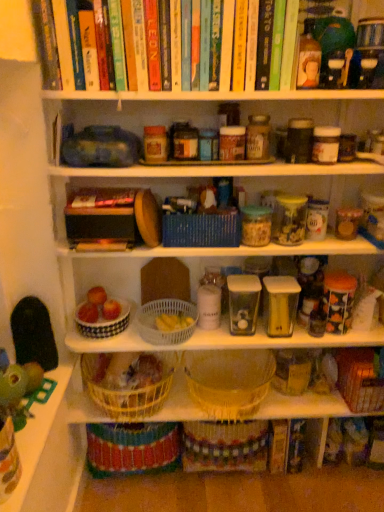
In order to face translucent plastic toy at lower left, the 1th toy from the front, should I rotate leftwards or rightwards?

To face it directly, rotate left by 23.573 degrees.

How much space does blue woven basket at center, arranged as the third basket when viewed from the right, occupy vertically?

blue woven basket at center, arranged as the third basket when viewed from the right, is 4.87 inches in height.

This screenshot has width=384, height=512. In order to click on transparent plastic container at center, the second glass jar viewed from the right in this screenshot , I will do tap(243, 303).

Locate an element on the screen. white plastic basket at center, acting as the fourth basket starting from the right is located at coordinates (165, 313).

I want to click on white ceramic bowl at center, the sixth basket when ordered from right to left, so click(x=105, y=323).

Between transparent plastic container at center-right, which ranks as the 1th glass jar in right-to-left order, and white plastic basket at center, acting as the fourth basket starting from the right, which one is positioned behind?

white plastic basket at center, acting as the fourth basket starting from the right, is further away from the camera.

Considering the sizes of objects transparent plastic container at center-right, which ranks as the second glass jar in left-to-right order, and white plastic basket at center, the 3th basket in the left-to-right sequence, in the image provided, who is taller, transparent plastic container at center-right, which ranks as the second glass jar in left-to-right order, or white plastic basket at center, the 3th basket in the left-to-right sequence,?

transparent plastic container at center-right, which ranks as the second glass jar in left-to-right order.

Considering the sizes of objects transparent plastic container at center-right, which ranks as the second glass jar in left-to-right order, and white plastic basket at center, the 3th basket in the left-to-right sequence, in the image provided, who is bigger, transparent plastic container at center-right, which ranks as the second glass jar in left-to-right order, or white plastic basket at center, the 3th basket in the left-to-right sequence,?

white plastic basket at center, the 3th basket in the left-to-right sequence, is bigger.

Is transparent plastic container at center-right, which ranks as the second glass jar in left-to-right order, oriented towards white plastic basket at center, acting as the fourth basket starting from the right?

No, transparent plastic container at center-right, which ranks as the second glass jar in left-to-right order, does not turn towards white plastic basket at center, acting as the fourth basket starting from the right.

Is point (118, 334) positioned behind point (285, 290)?

Yes.

Is white ceramic bowl at center, which is the 1th basket from left to right, far from transparent plastic container at center-right, which ranks as the 1th glass jar in right-to-left order?

Actually, white ceramic bowl at center, which is the 1th basket from left to right, and transparent plastic container at center-right, which ranks as the 1th glass jar in right-to-left order, are a little close together.

Would you say transparent plastic container at center-right, which ranks as the second glass jar in left-to-right order, is part of white ceramic bowl at center, which is the 1th basket from left to right,'s contents?

No.

Can we say blue woven basket at center, arranged as the third basket when viewed from the right, lies outside translucent plastic toy at lower left, the 1th toy from the front?

blue woven basket at center, arranged as the third basket when viewed from the right, lies outside translucent plastic toy at lower left, the 1th toy from the front,'s area.

How different are the orientations of blue woven basket at center, positioned as the fourth basket in left-to-right order, and translucent plastic toy at lower left, the 1th toy from the front, in degrees?

The angular difference between blue woven basket at center, positioned as the fourth basket in left-to-right order, and translucent plastic toy at lower left, the 1th toy from the front, is 93.3 degrees.

Relative to translucent plastic toy at lower left, which is the second toy in back-to-front order, is blue woven basket at center, positioned as the fourth basket in left-to-right order, in front or behind?

blue woven basket at center, positioned as the fourth basket in left-to-right order, is behind translucent plastic toy at lower left, which is the second toy in back-to-front order.

From the image's perspective, does blue woven basket at center, positioned as the fourth basket in left-to-right order, appear lower than translucent plastic toy at lower left, which is the second toy in back-to-front order?

No, from the image's perspective, blue woven basket at center, positioned as the fourth basket in left-to-right order, is not below translucent plastic toy at lower left, which is the second toy in back-to-front order.

Could you measure the distance between transparent plastic container at center, the second glass jar viewed from the right, and woven straw basket at center, marked as the 5th basket in a left-to-right arrangement?

They are 12.95 inches apart.

Is transparent plastic container at center, the second glass jar viewed from the right, facing away from woven straw basket at center, which is the second basket from right to left?

transparent plastic container at center, the second glass jar viewed from the right, is not turned away from woven straw basket at center, which is the second basket from right to left.

Based on the photo, from the image's perspective, is transparent plastic container at center, marked as the first glass jar in a left-to-right arrangement, above woven straw basket at center, marked as the 5th basket in a left-to-right arrangement?

Yes, from the image's perspective, transparent plastic container at center, marked as the first glass jar in a left-to-right arrangement, is on top of woven straw basket at center, marked as the 5th basket in a left-to-right arrangement.

Which of these two, transparent plastic container at center, marked as the first glass jar in a left-to-right arrangement, or woven straw basket at center, marked as the 5th basket in a left-to-right arrangement, is thinner?

With smaller width is transparent plastic container at center, marked as the first glass jar in a left-to-right arrangement.

The height and width of the screenshot is (512, 384). I want to click on basket that is the 1st object directly below the white plastic basket at center, acting as the fourth basket starting from the right (from a real-world perspective), so click(x=229, y=381).

Would you say white plastic basket at center, acting as the fourth basket starting from the right, is to the left or to the right of woven straw basket at center, marked as the 5th basket in a left-to-right arrangement, in the picture?

Based on their positions, white plastic basket at center, acting as the fourth basket starting from the right, is located to the left of woven straw basket at center, marked as the 5th basket in a left-to-right arrangement.

Can you tell me how much white plastic basket at center, the 3th basket in the left-to-right sequence, and woven straw basket at center, marked as the 5th basket in a left-to-right arrangement, differ in facing direction?

white plastic basket at center, the 3th basket in the left-to-right sequence, and woven straw basket at center, marked as the 5th basket in a left-to-right arrangement, are facing 0.00134 degrees away from each other.

Is woven straw basket at center, marked as the 5th basket in a left-to-right arrangement, at the back of white plastic basket at center, the 3th basket in the left-to-right sequence?

white plastic basket at center, the 3th basket in the left-to-right sequence, is not turned away from woven straw basket at center, marked as the 5th basket in a left-to-right arrangement.

Which object is closer to the camera, transparent plastic container at center-right, which ranks as the second glass jar in left-to-right order, or blue woven basket at center, positioned as the fourth basket in left-to-right order?

blue woven basket at center, positioned as the fourth basket in left-to-right order, is closer to the camera.

From the picture: Which point is more distant from viewer, (x=273, y=326) or (x=210, y=239)?

The point (x=273, y=326) is more distant.

Is transparent plastic container at center-right, which ranks as the 1th glass jar in right-to-left order, to the left of blue woven basket at center, positioned as the fourth basket in left-to-right order, from the viewer's perspective?

In fact, transparent plastic container at center-right, which ranks as the 1th glass jar in right-to-left order, is to the right of blue woven basket at center, positioned as the fourth basket in left-to-right order.

Between transparent plastic container at center-right, which ranks as the 1th glass jar in right-to-left order, and blue woven basket at center, positioned as the fourth basket in left-to-right order, which one has smaller width?

With smaller width is transparent plastic container at center-right, which ranks as the 1th glass jar in right-to-left order.

From a real-world perspective, is transparent plastic container at center, the second glass jar viewed from the right, positioned above or below translucent plastic toy at lower left, the 1th toy from the front?

transparent plastic container at center, the second glass jar viewed from the right, is situated higher than translucent plastic toy at lower left, the 1th toy from the front, in the real world.

Would you say transparent plastic container at center, the second glass jar viewed from the right, is outside translucent plastic toy at lower left, which is the second toy in back-to-front order?

Yes, transparent plastic container at center, the second glass jar viewed from the right, is located beyond the bounds of translucent plastic toy at lower left, which is the second toy in back-to-front order.

Does point (233, 315) come farther from viewer compared to point (26, 381)?

Yes, point (233, 315) is farther from viewer.

How many degrees apart are the facing directions of transparent plastic container at center, marked as the first glass jar in a left-to-right arrangement, and translucent plastic toy at lower left, the 1th toy from the front?

They differ by 92.2 degrees in their facing directions.

From a real-world perspective, count 2nd baskets downward from the transparent plastic container at center-right, which ranks as the second glass jar in left-to-right order, and point to it. Please provide its 2D coordinates.

[(165, 313)]

Starting from the transparent plastic container at center-right, which ranks as the 1th glass jar in right-to-left order, which basket is the 3rd one behind? Please provide its 2D coordinates.

[(105, 323)]

Looking at the image, which one is located further to transparent plastic container at center, the second glass jar viewed from the right, translucent plastic toy at lower left, the 1th toy from the front, or black rubber toy at left, which is the 1th toy in back-to-front order?

translucent plastic toy at lower left, the 1th toy from the front, is further to transparent plastic container at center, the second glass jar viewed from the right.

When comparing their distances from woven straw basket at center, marked as the 5th basket in a left-to-right arrangement, does transparent plastic container at center, the second glass jar viewed from the right, or white ceramic bowl at center, which is the 1th basket from left to right, seem closer?

transparent plastic container at center, the second glass jar viewed from the right, is positioned closer to the anchor woven straw basket at center, marked as the 5th basket in a left-to-right arrangement.

From the image, which object appears to be farther from transparent plastic container at center-right, which ranks as the 1th glass jar in right-to-left order, blue woven basket at center, arranged as the third basket when viewed from the right, or woven straw basket at center, marked as the 5th basket in a left-to-right arrangement?

woven straw basket at center, marked as the 5th basket in a left-to-right arrangement, is positioned further to the anchor transparent plastic container at center-right, which ranks as the 1th glass jar in right-to-left order.

Based on their spatial positions, is woven brown basket at lower right, which ranks as the first basket in right-to-left order, or translucent plastic toy at lower left, the 1th toy from the front, further from hardcover book at center?

woven brown basket at lower right, which ranks as the first basket in right-to-left order, is further to hardcover book at center.

Considering their positions, is hardcover book at center positioned further to translucent plastic toy at lower left, which is the second toy in back-to-front order, than black rubber toy at left, positioned as the second toy in front-to-back order?

The object further to translucent plastic toy at lower left, which is the second toy in back-to-front order, is hardcover book at center.

Looking at this image, from the image, which object appears to be nearer to blue woven basket at center, arranged as the third basket when viewed from the right, white ceramic bowl at center, the sixth basket when ordered from right to left, or black rubber toy at left, positioned as the second toy in front-to-back order?

white ceramic bowl at center, the sixth basket when ordered from right to left, lies closer to blue woven basket at center, arranged as the third basket when viewed from the right, than the other object.

Based on their spatial positions, is white ceramic bowl at center, which is the 1th basket from left to right, or black rubber toy at left, positioned as the second toy in front-to-back order, closer to translucent plastic toy at lower left, which is the second toy in back-to-front order?

The object closer to translucent plastic toy at lower left, which is the second toy in back-to-front order, is black rubber toy at left, positioned as the second toy in front-to-back order.

Which object lies further to the anchor point translucent plastic toy at lower left, which is the second toy in back-to-front order, transparent plastic container at center-right, which ranks as the second glass jar in left-to-right order, or woven brown basket at lower right, marked as the sixth basket in a left-to-right arrangement?

woven brown basket at lower right, marked as the sixth basket in a left-to-right arrangement, is further to translucent plastic toy at lower left, which is the second toy in back-to-front order.

The image size is (384, 512). I want to click on book between black rubber toy at left, which is the 1th toy in back-to-front order, and transparent plastic container at center, marked as the first glass jar in a left-to-right arrangement, in the horizontal direction, so click(x=103, y=198).

Where is `glass jar located between translucent plastic toy at lower left, the 1th toy from the front, and transparent plastic container at center-right, which ranks as the 1th glass jar in right-to-left order, in the left-right direction`? The image size is (384, 512). glass jar located between translucent plastic toy at lower left, the 1th toy from the front, and transparent plastic container at center-right, which ranks as the 1th glass jar in right-to-left order, in the left-right direction is located at coordinates (243, 303).

You are a GUI agent. You are given a task and a screenshot of the screen. Output one action in this format:
    pyautogui.click(x=<x>, y=<y>)
    Task: Click on the book situated between translucent plastic toy at lower left, which is the second toy in back-to-front order, and woven brown basket at lower right, marked as the sixth basket in a left-to-right arrangement, from left to right
    Image resolution: width=384 pixels, height=512 pixels.
    Given the screenshot: What is the action you would take?
    pyautogui.click(x=103, y=198)

Locate an element on the screen. This screenshot has height=512, width=384. toy between translucent plastic toy at lower left, the 1th toy from the front, and white ceramic bowl at center, which is the 1th basket from left to right, from front to back is located at coordinates (33, 334).